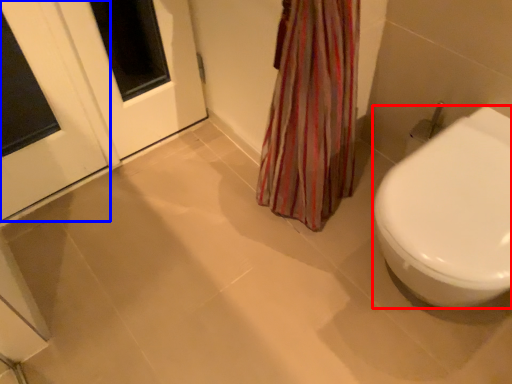
Question: Which point is closer to the camera, bidet (highlighted by a red box) or door (highlighted by a blue box)?

Choices:
 (A) bidet
 (B) door

Answer: (A)